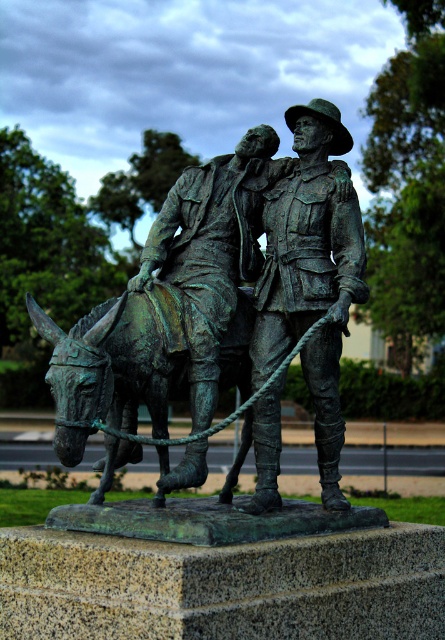
Is green patina bronze statue at center shorter than green patina horse at lower left?

Incorrect, green patina bronze statue at center's height does not fall short of green patina horse at lower left's.

Does green patina bronze statue at center have a greater width compared to green patina horse at lower left?

Indeed, green patina bronze statue at center has a greater width compared to green patina horse at lower left.

What are the coordinates of `green patina bronze statue at center` in the screenshot? It's located at (267, 260).

Does green patina bronze statue at center have a larger size compared to bronze statue at center?

Yes.

Does point (318, 460) come behind point (298, 112)?

No, it is in front of (298, 112).

Where is `green patina bronze statue at center`? This screenshot has width=445, height=640. green patina bronze statue at center is located at coordinates (267, 260).

Locate an element on the screen. green patina bronze statue at center is located at coordinates (267, 260).

Is bronze statue at center behind green patina horse at lower left?

Yes, it is.

Where is `bronze statue at center`? bronze statue at center is located at coordinates (311, 275).

This screenshot has height=640, width=445. What are the coordinates of `bronze statue at center` in the screenshot? It's located at (311, 275).